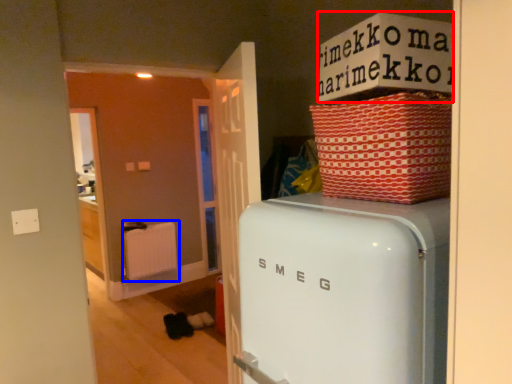
Question: Which object is further to the camera taking this photo, cardboard box (highlighted by a red box) or radiator (highlighted by a blue box)?

Choices:
 (A) cardboard box
 (B) radiator

Answer: (B)